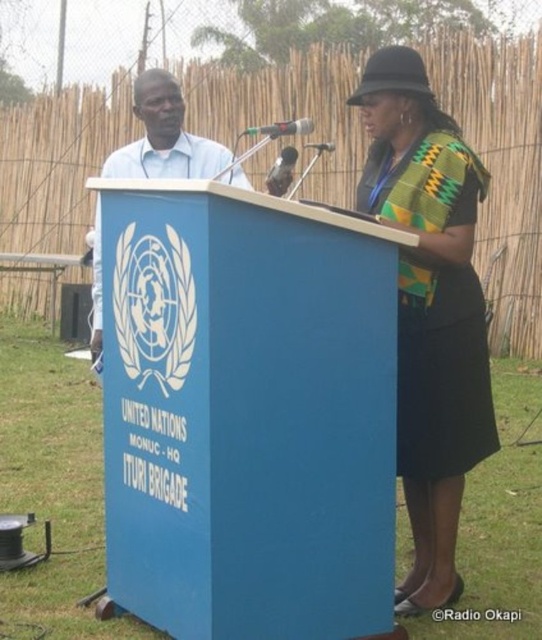
Question: Does blue painted wood podium at center come behind kente fabric dress at right?

Choices:
 (A) no
 (B) yes

Answer: (A)

Question: Is matte blue podium at left below metallic shiny microphone at center?

Choices:
 (A) no
 (B) yes

Answer: (B)

Question: Which point is closer to the camera taking this photo?

Choices:
 (A) (266, 132)
 (B) (451, 381)
 (C) (327, 141)

Answer: (B)

Question: Can you confirm if blue painted wood podium at center is smaller than metallic/matte black microphone at center?

Choices:
 (A) yes
 (B) no

Answer: (A)

Question: Which of the following is the closest to the observer?

Choices:
 (A) (99, 236)
 (B) (478, 440)
 (C) (108, 433)
 (D) (324, 145)

Answer: (B)

Question: Which object is closer to the camera taking this photo?

Choices:
 (A) blue painted wood podium at center
 (B) metallic/matte black microphone at center
 (C) metallic shiny microphone at center

Answer: (A)